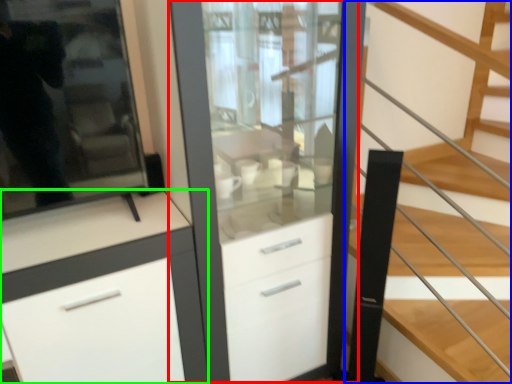
Question: Considering the real-world distances, which object is farthest from dresser (highlighted by a red box)? stairs (highlighted by a blue box) or cabinetry (highlighted by a green box)?

Choices:
 (A) stairs
 (B) cabinetry

Answer: (A)